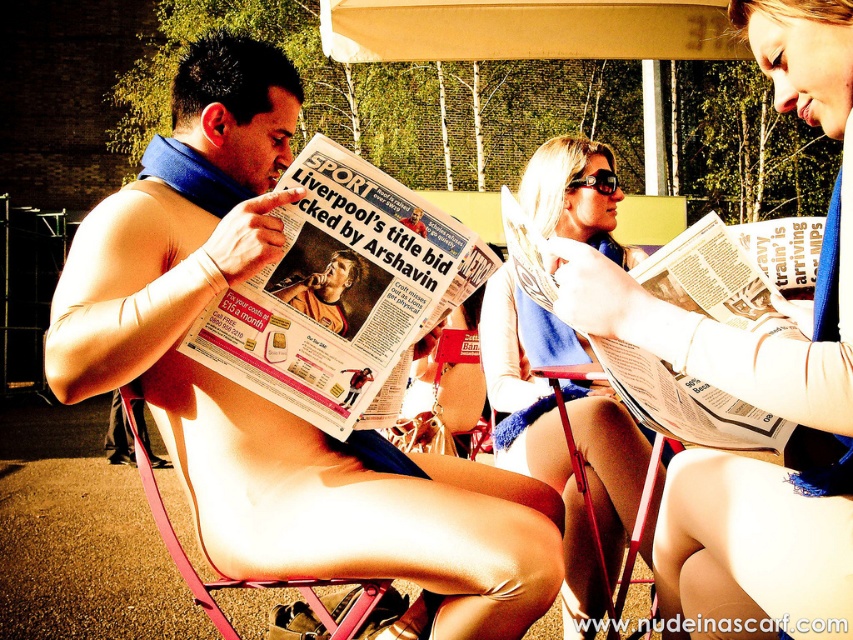
Question: In this image, where is blue fabric scarf at upper center located relative to blue fabric scarf at center?

Choices:
 (A) below
 (B) above

Answer: (B)

Question: Does matte blue scarf at upper left come behind blue fabric scarf at upper center?

Choices:
 (A) no
 (B) yes

Answer: (B)

Question: Can you confirm if pink plastic beach chair at lower center is positioned above matte newspaper at center?

Choices:
 (A) no
 (B) yes

Answer: (A)

Question: Among these points, which one is nearest to the camera?

Choices:
 (A) (358, 602)
 (B) (292, 282)
 (C) (514, 292)

Answer: (B)

Question: Among these objects, which one is nearest to the camera?

Choices:
 (A) black plastic goggles at upper center
 (B) blue fabric scarf at center

Answer: (B)

Question: Which point is closer to the camera?

Choices:
 (A) (608, 186)
 (B) (347, 266)
 (C) (688, 568)
 (D) (129, 404)

Answer: (C)